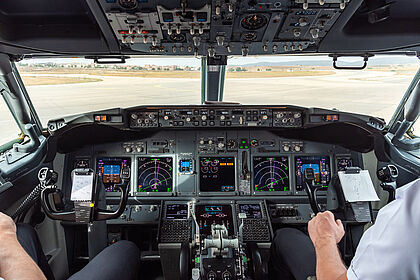
You are a GUI agent. You are given a task and a screenshot of the screen. Output one action in this format:
    pyautogui.click(x=<x>, y=<y>)
    Task: Click on the monitor
    
    Given the screenshot: What is the action you would take?
    pyautogui.click(x=155, y=176), pyautogui.click(x=274, y=172)